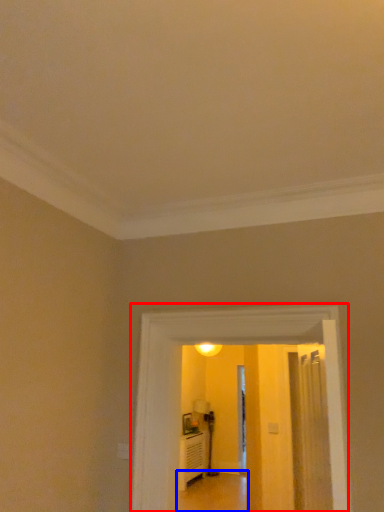
Question: Which object appears closest to the camera in this image, corridor (highlighted by a red box) or path (highlighted by a blue box)?

Choices:
 (A) corridor
 (B) path

Answer: (A)